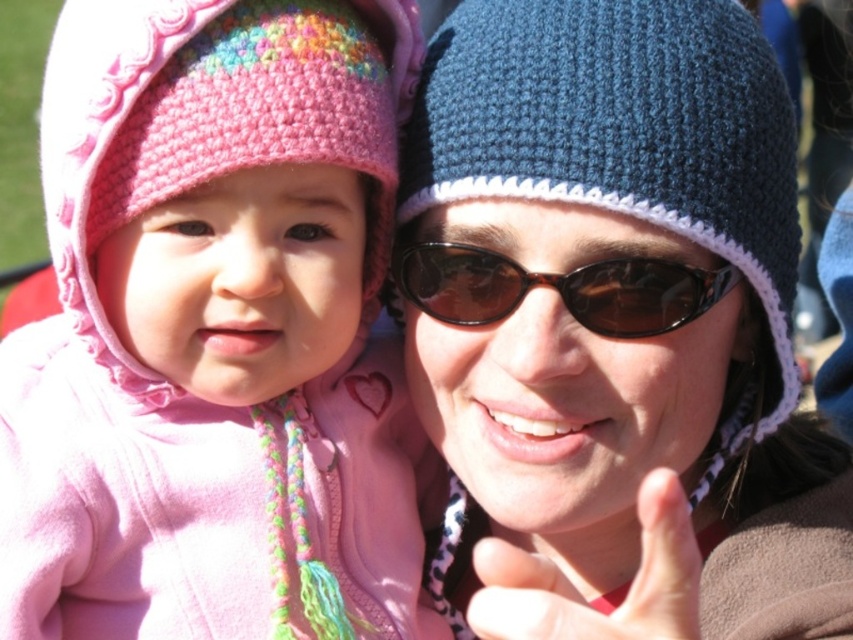
You are a photographer trying to capture a photo of the two hats in the scene. The matte pink knit hat at left and the knitted blue hat at center are both in your viewfinder. According to the scene, which hat is positioned to the left side of the other?

The matte pink knit hat at left is positioned to the left of the knitted blue hat at center.

You are a photographer trying to capture a close shot of the tortoiseshell sunglasses at center without including the matte pink knit hat at left. Based on their positions, is this possible?

The matte pink knit hat at left is positioned on the left side of tortoiseshell sunglasses at center, so if you move the camera slightly to the right or zoom in, you can focus on the tortoiseshell sunglasses at center while excluding the matte pink knit hat at left.

You are a photographer trying to capture a clear shot of both the knitted blue hat at center and the tortoiseshell sunglasses at center. If you want to ensure the entire width of both items fits in the frame, which item requires more careful adjustment to avoid being cut off?

The knitted blue hat at center might be wider than tortoiseshell sunglasses at center, so it requires more careful adjustment to avoid being cut off.